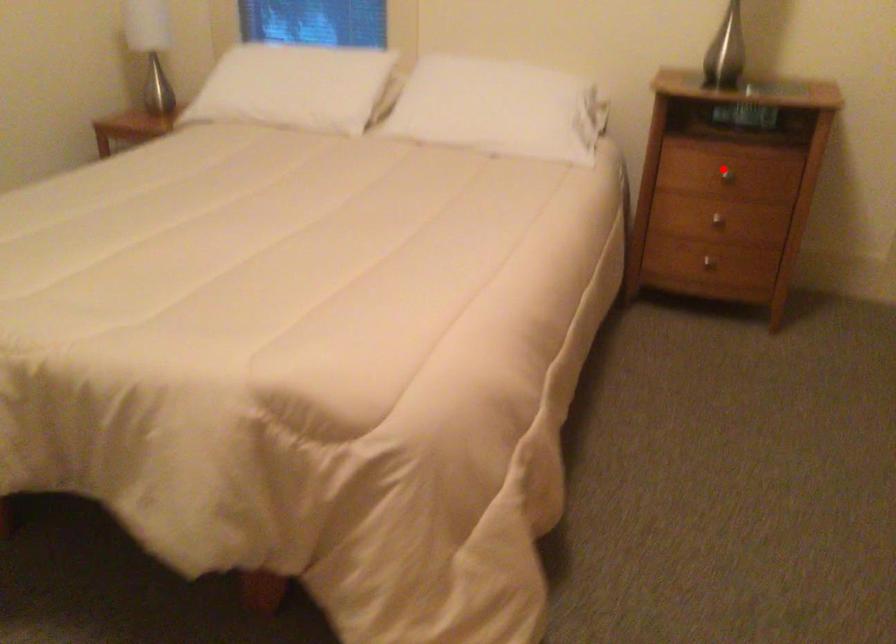
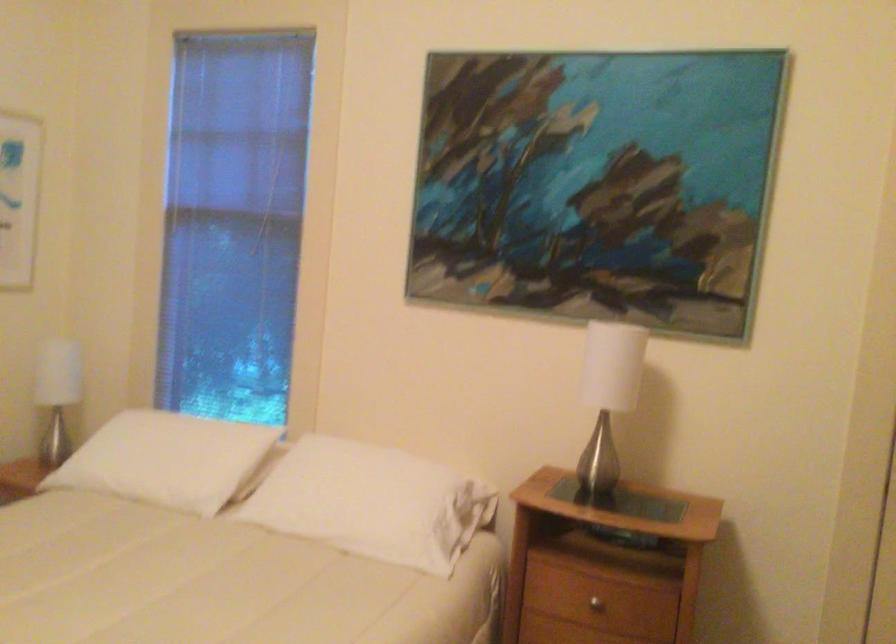
Question: I am providing you with two images of the same scene from different viewpoints. Given a red point in image1, look at the same physical point in image2. Is it:

Choices:
 (A) Closer to the viewpoint
 (B) Farther from the viewpoint

Answer: (A)